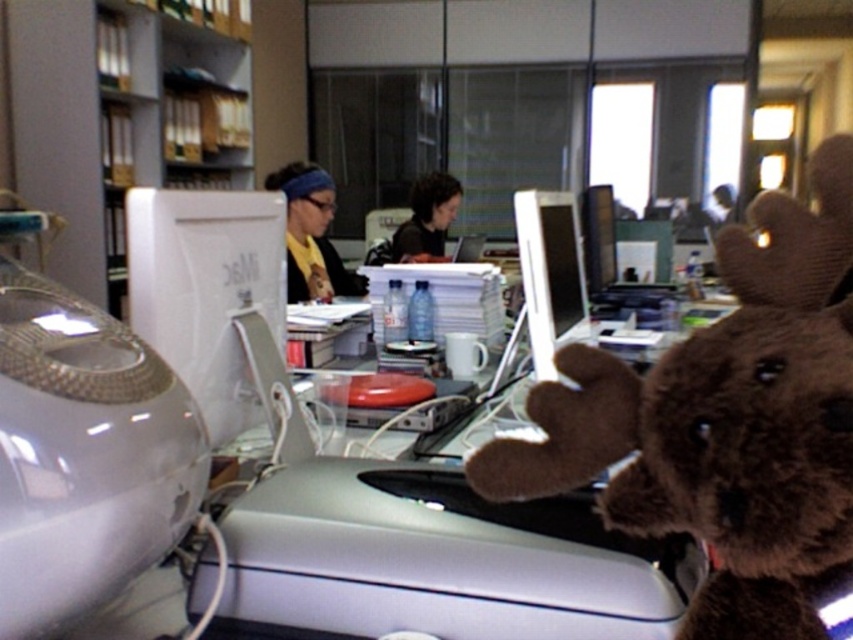
You are organizing an office space and need to ensure there is enough space between the brown plush toy at center and the white glossy monitor at center for a cable to run behind them. The cable requires a minimum of 20 inches of space. Can the cable be placed between them?

The brown plush toy at center is 22.81 inches from the white glossy monitor at center, which is more than the required 20 inches. Therefore, the cable can be placed between them.

You are a delivery person who needs to place a small package on the desk without blocking the white glossy monitor at center. Based on the coordinates provided, where should you place the package?

The white glossy monitor at center is located at coordinates point (207,291). To avoid blocking it, place the package away from this position, perhaps to the sides or below the monitor.

You are organizing the desk in the image. You need to move the dark brown plush toy at center so that it no longer blocks the white glossy monitor at center. Which direction should you move it?

The white glossy monitor at center is located below the dark brown plush toy at center, so moving the dark brown plush toy at center upwards would prevent it from blocking the monitor.